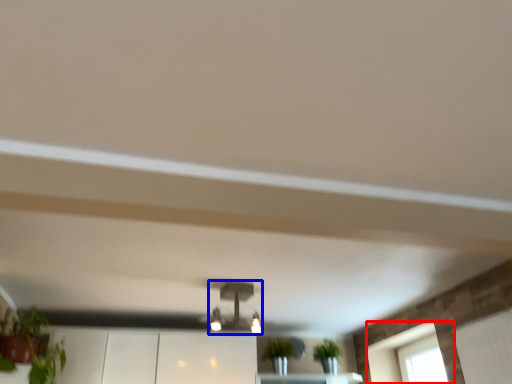
Question: Which object appears closest to the camera in this image, window (highlighted by a red box) or light fixture (highlighted by a blue box)?

Choices:
 (A) window
 (B) light fixture

Answer: (B)